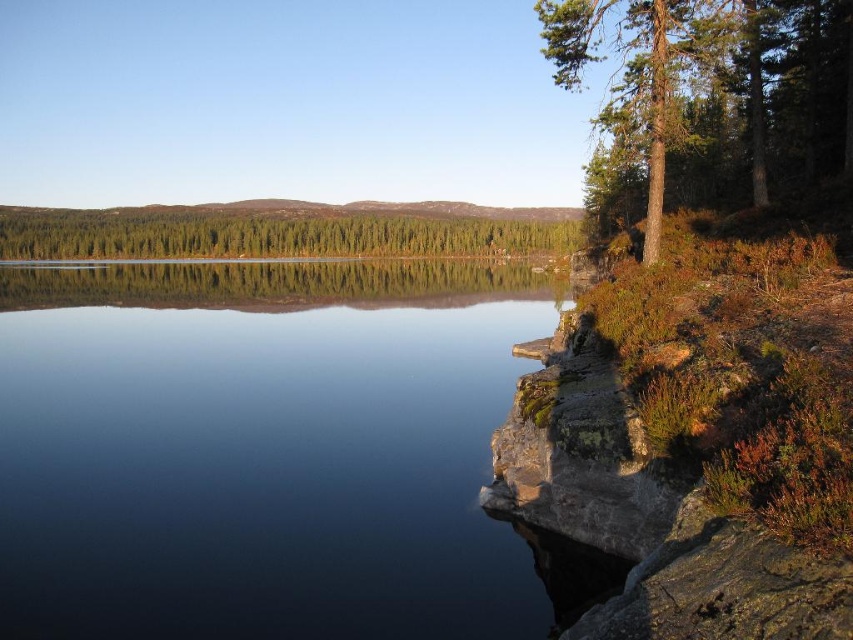
You are an artist trying to paint the scene. The transparent glass water at center and the green matte trees at center are crucial elements. Based on their positions, which one should you paint first to ensure proper layering?

The green matte trees at center should be painted first because the transparent glass water at center is below them, allowing the water to be layered over the trees for accurate positioning.

You are standing at the edge of the serene natural landscape shown in the image. There are two points marked in the scene, point [807,48] and point [521,236]. Which point is closer to your current position?

Answer: Point [807,48] is closer to the camera than point [521,236], so the point closer to your current position is point [807,48].

You are standing at the edge of the water in the serene landscape scene. There are two points marked in the image. Which point, point [345,317] or point [524,218], is closer to your current position?

Point [345,317] is closer to the camera than point [524,218], so it is closer to your current position.